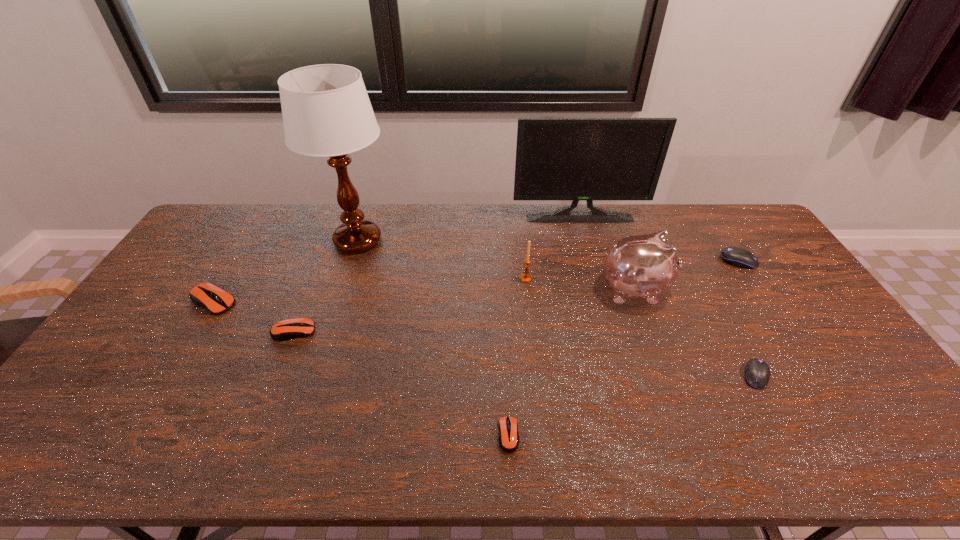
You are a GUI agent. You are given a task and a screenshot of the screen. Output one action in this format:
    pyautogui.click(x=<x>, y=<y>)
    Task: Click on the free region at the near edge of the desktop
    The image size is (960, 540).
    Given the screenshot: What is the action you would take?
    pyautogui.click(x=374, y=435)

You are a GUI agent. You are given a task and a screenshot of the screen. Output one action in this format:
    pyautogui.click(x=<x>, y=<y>)
    Task: Click on the free space at the left edge of the desktop
    The height and width of the screenshot is (540, 960).
    Given the screenshot: What is the action you would take?
    pyautogui.click(x=208, y=256)

Where is `vacant point at the right edge`? The width and height of the screenshot is (960, 540). vacant point at the right edge is located at coordinates (821, 380).

The height and width of the screenshot is (540, 960). In the image, there is a desktop. In order to click on vacant space at the far left corner in this screenshot , I will do `click(246, 219)`.

In the image, there is a desktop. Identify the location of vacant space at the far right corner. (718, 233).

What are the coordinates of `unoccupied position between the third computer mouse from right to left and the leftmost orange computer mouse` in the screenshot? It's located at (361, 369).

Find the location of `free spot between the farther black computer mouse and the table lamp`. free spot between the farther black computer mouse and the table lamp is located at coordinates (548, 251).

Identify the location of vacant space that is in between the right black computer mouse and the white table lamp. (548, 251).

What are the coordinates of `vacant area that lies between the right black computer mouse and the table lamp` in the screenshot? It's located at (548, 251).

Locate an element on the screen. empty location between the monitor and the candle_holder is located at coordinates (553, 248).